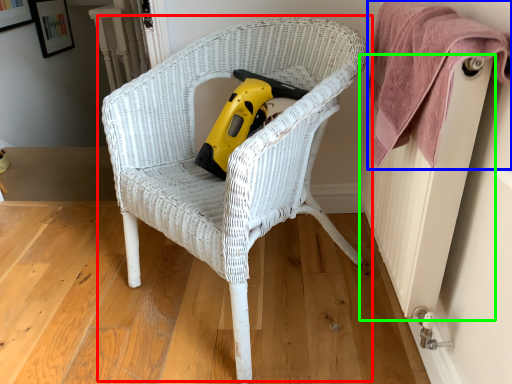
Question: Based on their relative distances, which object is nearer to chair (highlighted by a red box)? Choose from towel (highlighted by a blue box) and radiator (highlighted by a green box).

Choices:
 (A) towel
 (B) radiator

Answer: (A)